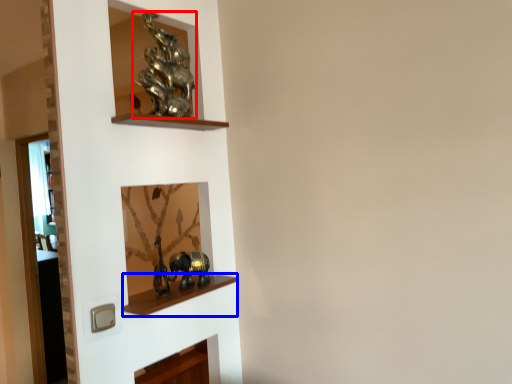
Question: Among these objects, which one is farthest to the camera, art (highlighted by a red box) or cabinet (highlighted by a blue box)?

Choices:
 (A) art
 (B) cabinet

Answer: (A)